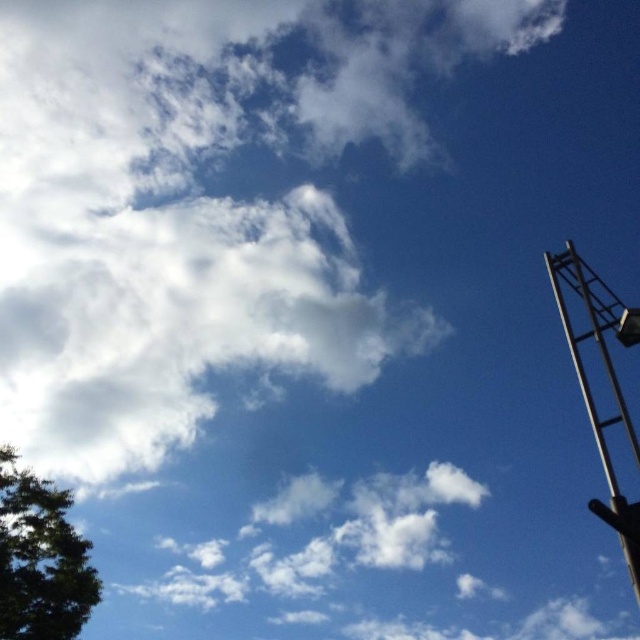
Does white fluffy cloud at upper center come behind metallic silver crane at right?

Yes, white fluffy cloud at upper center is behind metallic silver crane at right.

The image size is (640, 640). Find the location of `white fluffy cloud at upper center`. white fluffy cloud at upper center is located at coordinates (196, 204).

Describe the element at coordinates (196, 204) in the screenshot. Image resolution: width=640 pixels, height=640 pixels. I see `white fluffy cloud at upper center` at that location.

The height and width of the screenshot is (640, 640). I want to click on white fluffy cloud at upper center, so click(x=196, y=204).

Is white fluffy cloud at upper center shorter than green leafy tree at lower left?

Incorrect, white fluffy cloud at upper center's height does not fall short of green leafy tree at lower left's.

Between white fluffy cloud at upper center and green leafy tree at lower left, which one is positioned lower?

green leafy tree at lower left is lower down.

What do you see at coordinates (196, 204) in the screenshot? The image size is (640, 640). I see `white fluffy cloud at upper center` at bounding box center [196, 204].

I want to click on white fluffy cloud at upper center, so click(x=196, y=204).

Describe the element at coordinates (40, 560) in the screenshot. Image resolution: width=640 pixels, height=640 pixels. I see `green leafy tree at lower left` at that location.

Identify the location of green leafy tree at lower left. (40, 560).

You are a GUI agent. You are given a task and a screenshot of the screen. Output one action in this format:
    pyautogui.click(x=<x>, y=<y>)
    Task: Click on the green leafy tree at lower left
    
    Given the screenshot: What is the action you would take?
    pyautogui.click(x=40, y=560)